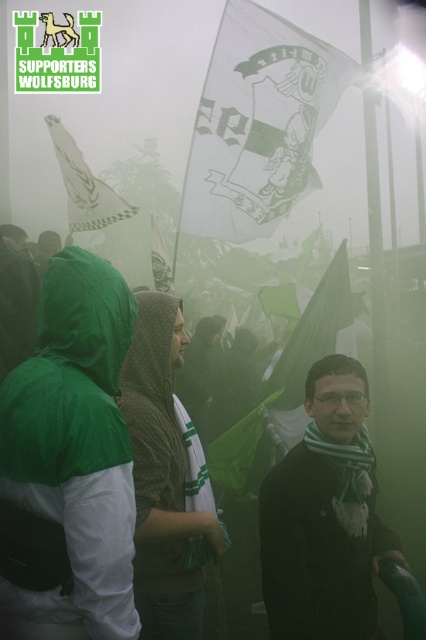
Question: Which of the following is the closest to the observer?

Choices:
 (A) (310, 467)
 (B) (25, 257)
 (C) (203, 211)
 (D) (147, 577)

Answer: (A)

Question: Does transparent plastic flag at upper center appear on the left side of green wool scarf at center?

Choices:
 (A) yes
 (B) no

Answer: (A)

Question: Can you confirm if transparent plastic flag at upper center is bigger than green wool scarf at center?

Choices:
 (A) no
 (B) yes

Answer: (B)

Question: Which point is closer to the camera?

Choices:
 (A) (34, 538)
 (B) (328, 60)
 (C) (143, 545)

Answer: (A)

Question: Can you confirm if transparent plastic flag at upper center is smaller than white paper flag at upper left?

Choices:
 (A) no
 (B) yes

Answer: (B)

Question: Among these objects, which one is nearest to the camera?

Choices:
 (A) green wool scarf at center
 (B) white paper flag at upper left
 (C) green fabric hood at left

Answer: (C)